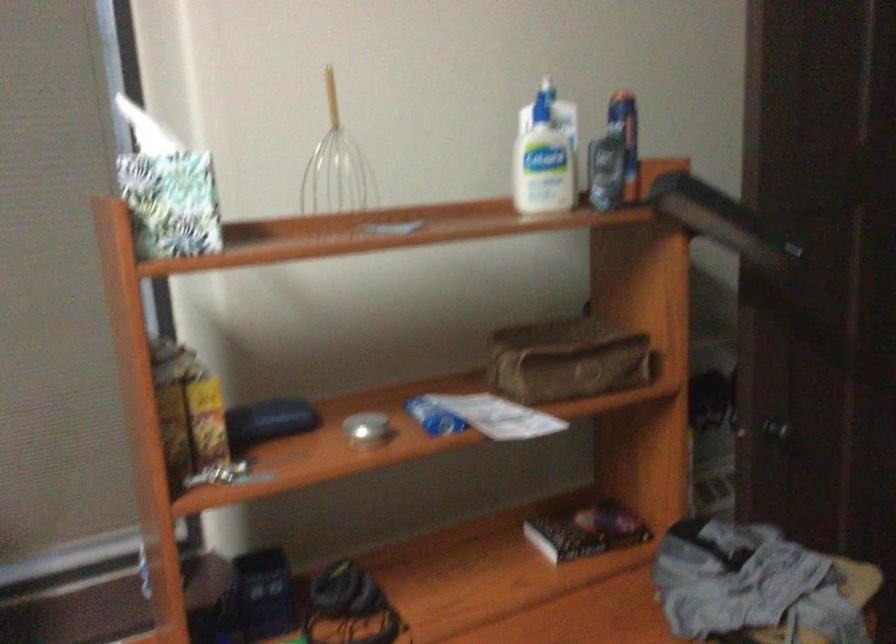
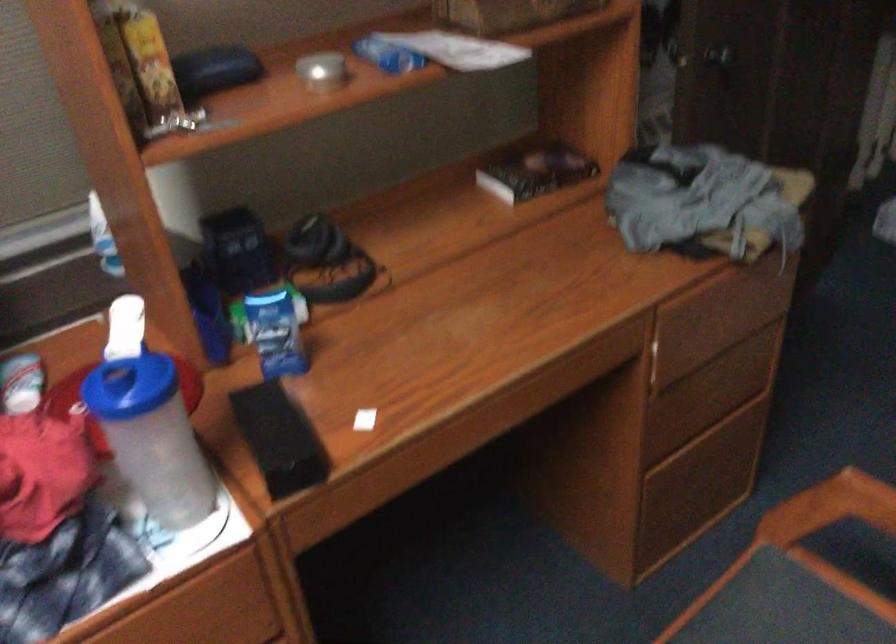
The point at [582,532] is marked in the first image. Where is the corresponding point in the second image?

(536, 172)